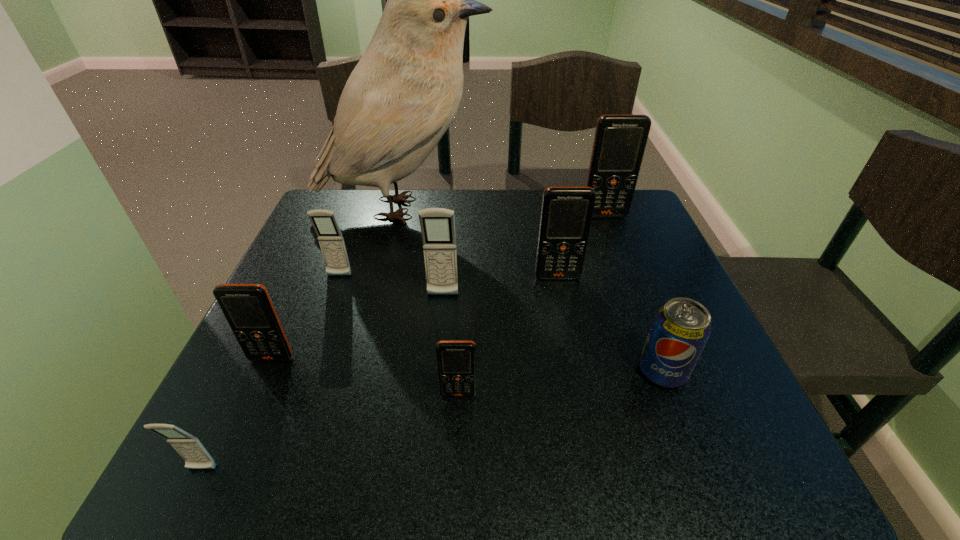
Locate an element on the screen. The height and width of the screenshot is (540, 960). the tallest object is located at coordinates (403, 94).

Image resolution: width=960 pixels, height=540 pixels. In order to click on white parakeet in this screenshot , I will do `click(403, 94)`.

Find the location of a particular element. The height and width of the screenshot is (540, 960). the rightmost cellular telephone is located at coordinates (620, 140).

Find the location of a particular element. the farthest orange cellular telephone is located at coordinates (620, 140).

Image resolution: width=960 pixels, height=540 pixels. Find the location of `the biggest gray cellular telephone`. the biggest gray cellular telephone is located at coordinates (437, 225).

I want to click on the rightmost gray cellular telephone, so click(x=437, y=225).

Where is `the second biggest orange cellular telephone`? The height and width of the screenshot is (540, 960). the second biggest orange cellular telephone is located at coordinates (566, 214).

Locate an element on the screen. This screenshot has height=540, width=960. the third orange cellular telephone from left to right is located at coordinates (566, 214).

Locate an element on the screen. This screenshot has width=960, height=540. the second gray cellular telephone from left to right is located at coordinates (330, 238).

Image resolution: width=960 pixels, height=540 pixels. Identify the location of the third cellular telephone from left to right. (330, 238).